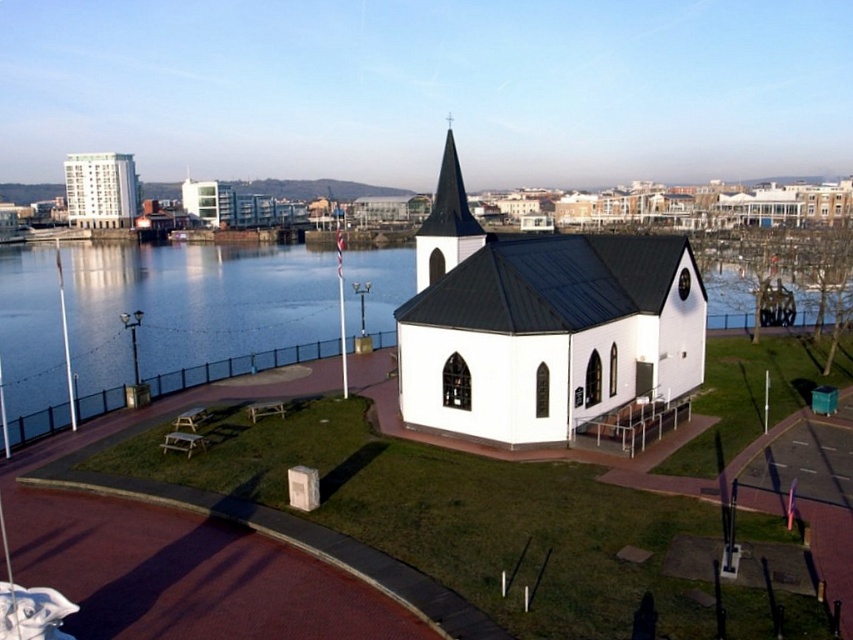
Who is lower down, white matte chapel at center or white smooth building at upper left?

white matte chapel at center is lower down.

Who is positioned more to the left, white matte chapel at center or white smooth building at upper left?

Positioned to the left is white smooth building at upper left.

Who is more distant from viewer, (502,337) or (97,160)?

Point (97,160)

The height and width of the screenshot is (640, 853). What are the coordinates of `white matte chapel at center` in the screenshot? It's located at pos(540,324).

Between blue water at center and smooth white steeple at center, which one has more height?

With more height is blue water at center.

What do you see at coordinates (193, 316) in the screenshot?
I see `blue water at center` at bounding box center [193, 316].

Does point (408, 253) come closer to viewer compared to point (434, 221)?

That is False.

Locate an element on the screen. This screenshot has height=640, width=853. blue water at center is located at coordinates pyautogui.click(x=193, y=316).

Does blue water at center have a smaller size compared to white smooth building at upper left?

No, blue water at center is not smaller than white smooth building at upper left.

Is blue water at center further to the viewer compared to white smooth building at upper left?

That is False.

Is point (251, 330) behind point (120, 160)?

No, it is in front of (120, 160).

This screenshot has width=853, height=640. Identify the location of blue water at center. (193, 316).